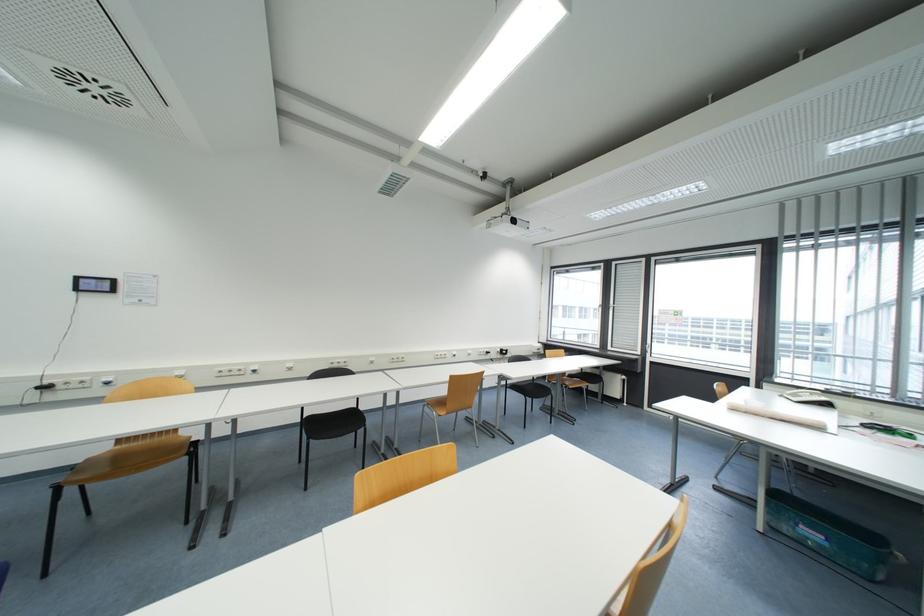
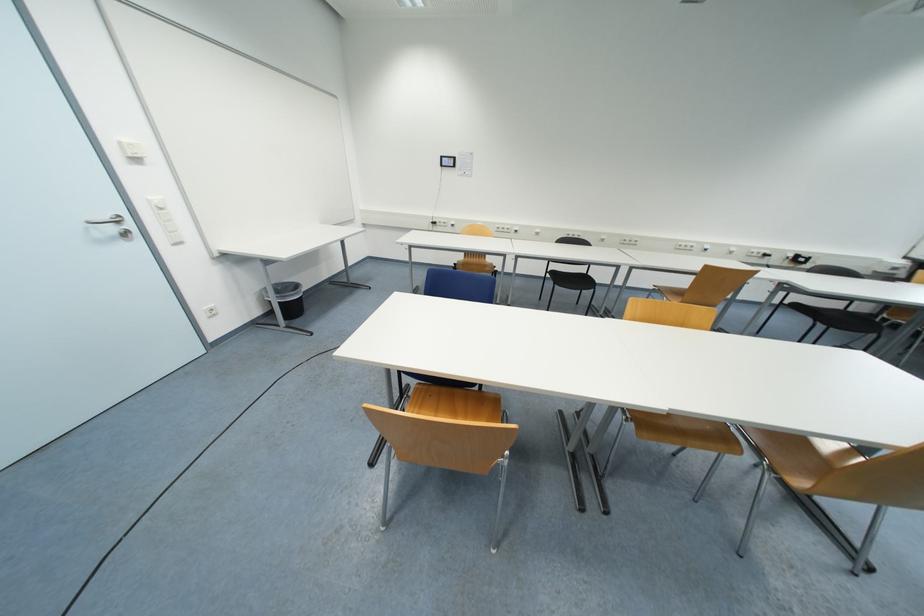
Based on the continuous images, in which direction is the camera rotating?

The camera rotated toward left-down.